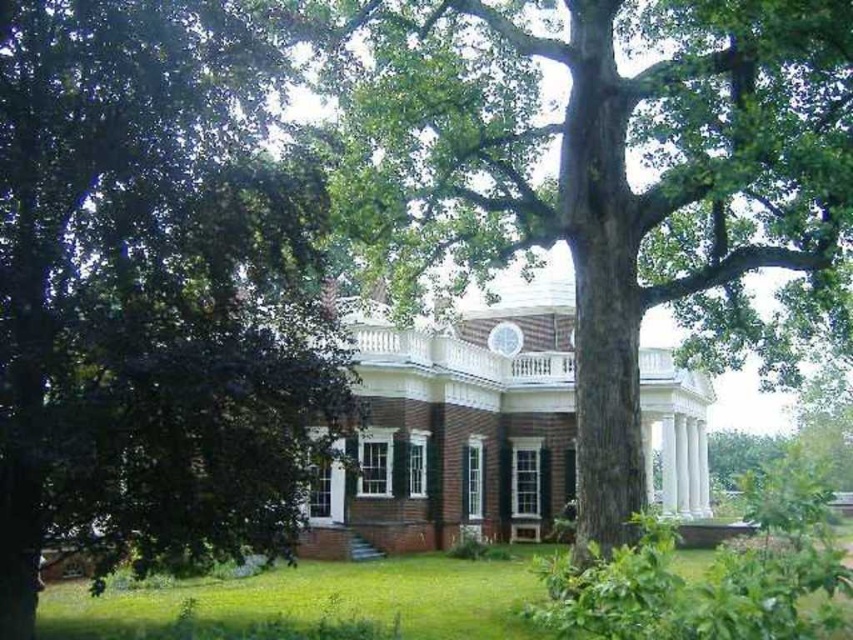
Question: Which point is farther to the camera?

Choices:
 (A) (108, 618)
 (B) (577, 416)
 (C) (140, 512)

Answer: (B)

Question: Which point is closer to the camera taking this photo?

Choices:
 (A) (100, 116)
 (B) (514, 584)

Answer: (A)

Question: Is green leafy tree at left to the right of green grass at lower center from the viewer's perspective?

Choices:
 (A) no
 (B) yes

Answer: (A)

Question: Does smooth brown tree trunk at center have a lesser width compared to green grass at lower center?

Choices:
 (A) no
 (B) yes

Answer: (B)

Question: Which object appears farthest from the camera in this image?

Choices:
 (A) smooth brown tree trunk at center
 (B) green leafy tree at left
 (C) green grass at lower center

Answer: (A)

Question: Is green leafy tree at left wider than green grass at lower center?

Choices:
 (A) yes
 (B) no

Answer: (B)